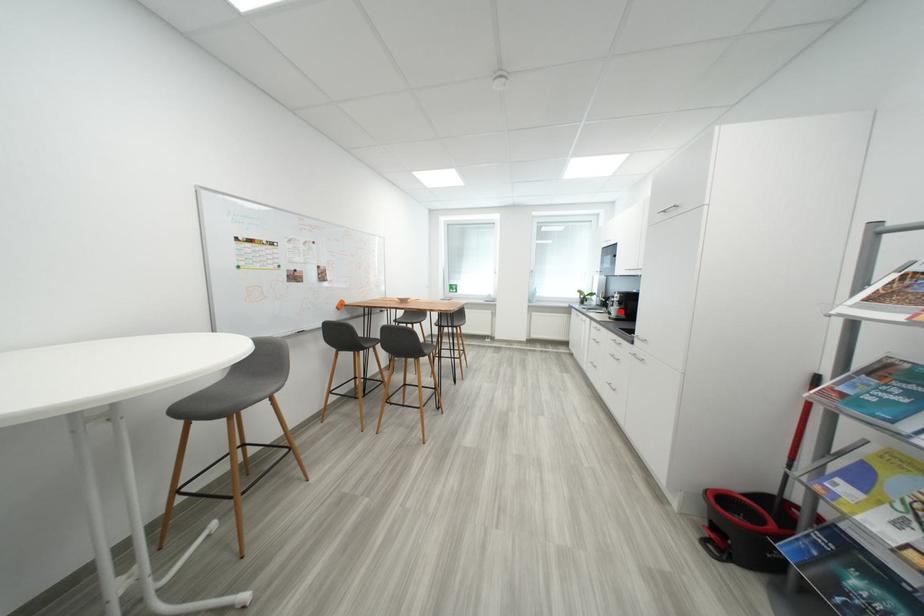
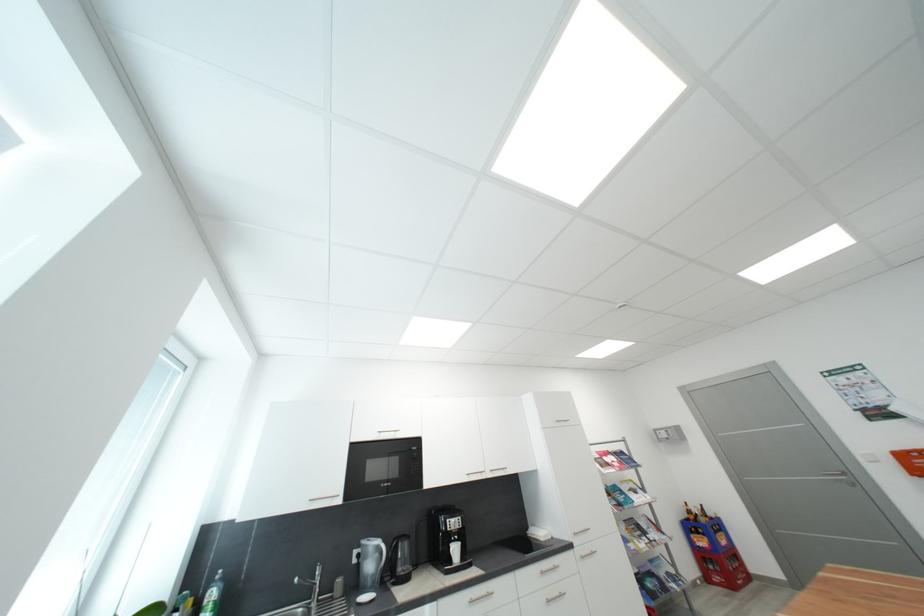
In the second image, find the point that corresponds to the highlighted location in the first image.

(463, 552)